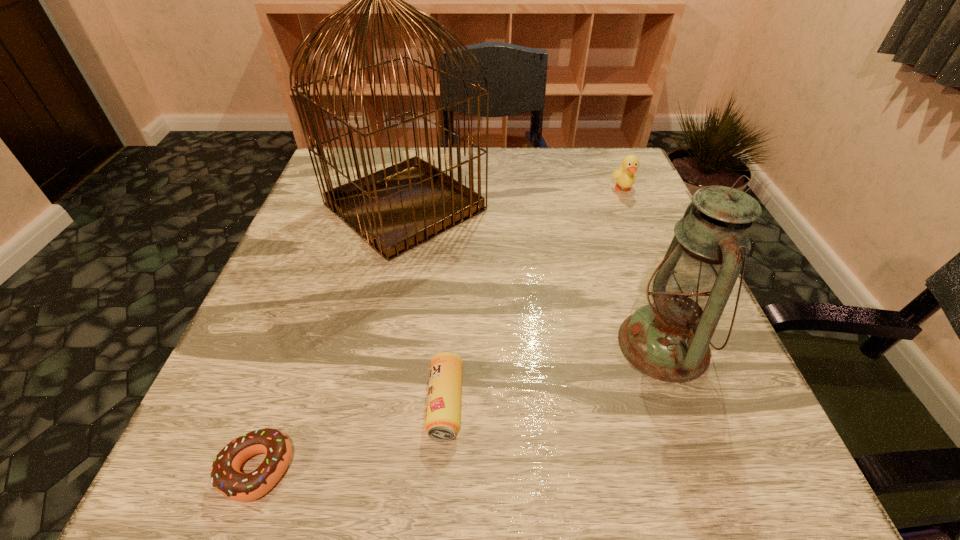
Locate an element on the screen. vacant point located between the beer can and the oil lamp is located at coordinates (554, 374).

The image size is (960, 540). In order to click on free spot between the tallest object and the oil lamp in this screenshot , I will do `click(534, 276)`.

At what (x,y) coordinates should I click in order to perform the action: click on free spot between the beer can and the tallest object. Please return your answer as a coordinate pair (x, y). Looking at the image, I should click on (425, 305).

Where is `empty location between the third shortest object and the beer can`? The height and width of the screenshot is (540, 960). empty location between the third shortest object and the beer can is located at coordinates (534, 296).

Find the location of a particular element. This screenshot has width=960, height=540. vacant point located between the second tallest object and the beer can is located at coordinates (554, 374).

Where is `vacant region between the tallest object and the fourth tallest object`? This screenshot has height=540, width=960. vacant region between the tallest object and the fourth tallest object is located at coordinates (425, 305).

Identify which object is the fourth closest to the birdcage. Please provide its 2D coordinates. Your answer should be formatted as a tuple, i.e. [(x, y)], where the tuple contains the x and y coordinates of a point satisfying the conditions above.

[(226, 477)]

At what (x,y) coordinates should I click in order to perform the action: click on object that is the third closest one to the shortest object. Please return your answer as a coordinate pair (x, y). This screenshot has height=540, width=960. Looking at the image, I should click on (668, 339).